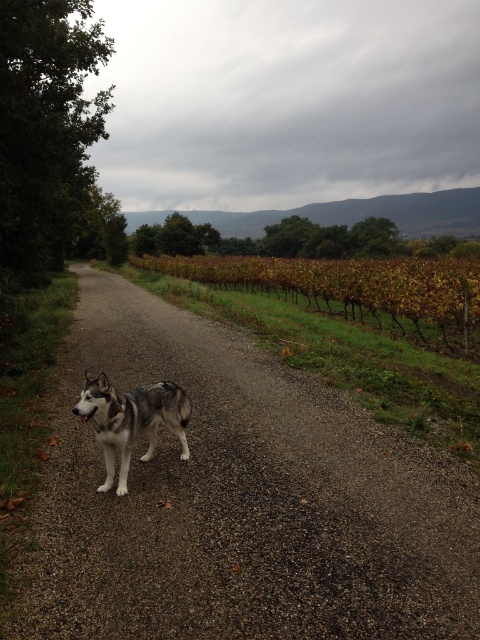
You are standing at point (240, 502) in the vineyard scene. What is the terrain you are currently standing on?

The terrain at point (240, 502) is gray gravel road at center.

You are a hiker walking along the gravel path in the vineyard. You see the green leafy vines at center and the gray fur dog at center. Which object is taller?

The green leafy vines at center are taller than the gray fur dog at center.